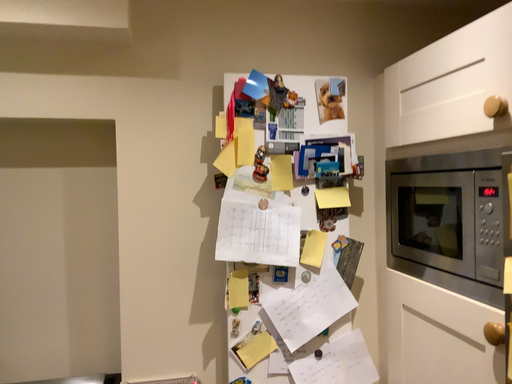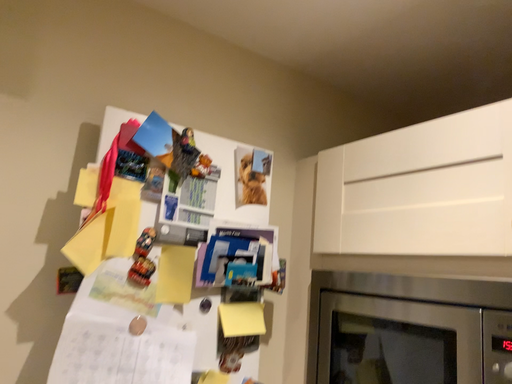
Question: Which way did the camera rotate in the video?

Choices:
 (A) rotated left
 (B) rotated right

Answer: (B)